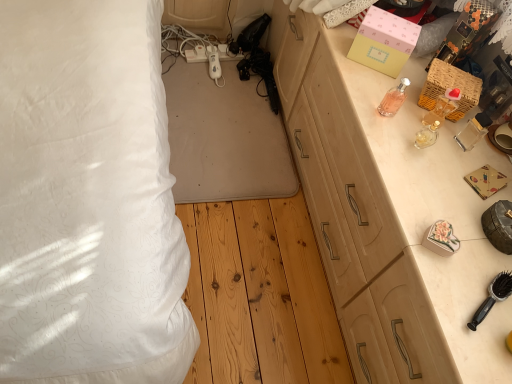
Locate an element on the screen. Image resolution: width=512 pixels, height=384 pixels. vacant area situated to the left side of pink matte box at upper right, placed as the first box when sorted from left to right is located at coordinates (332, 35).